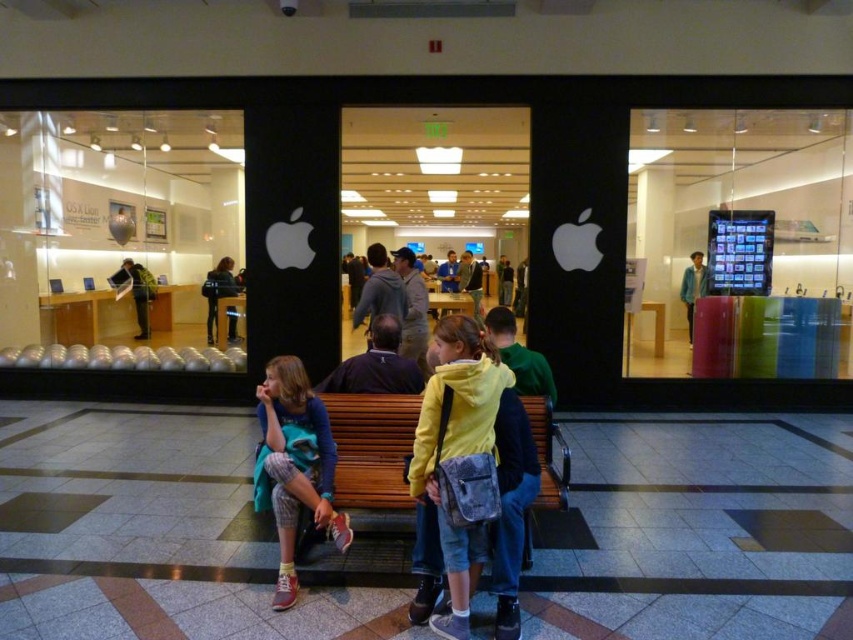
Question: Which of these objects is positioned farthest from the brown wooden bench at center?

Choices:
 (A) yellow matte jacket at center
 (B) dark blue hoodie at center
 (C) blue denim jacket at center
 (D) green fabric jacket at center

Answer: (D)

Question: Is dark blue hoodie at center below green fabric jacket at center?

Choices:
 (A) no
 (B) yes

Answer: (A)

Question: Observing the image, what is the correct spatial positioning of yellow matte jacket at center in reference to green fabric jacket at center?

Choices:
 (A) below
 (B) above

Answer: (A)

Question: Which of the following is the farthest from the observer?

Choices:
 (A) yellow matte jacket at center
 (B) matte blue hoodie at center
 (C) green fabric jacket at center
 (D) brown wooden bench at center

Answer: (C)

Question: Can you confirm if green fabric jacket at center is thinner than blue denim jacket at center?

Choices:
 (A) no
 (B) yes

Answer: (A)

Question: Which point is farther to the camera?

Choices:
 (A) green fabric jacket at center
 (B) yellow matte jacket at center

Answer: (A)